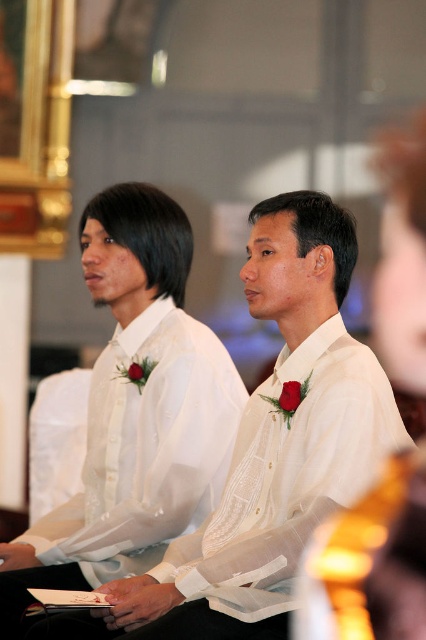
You are a photographer preparing to take a group photo of the two individuals wearing the white embroidered shirt at center and the white sheer shirt at center. To ensure both shirts are fully visible in the frame, which shirt should you position closer to the camera?

The white embroidered shirt at center is not as tall as white sheer shirt at center, so you should position the white embroidered shirt at center closer to the camera to ensure both shirts are fully visible in the frame.